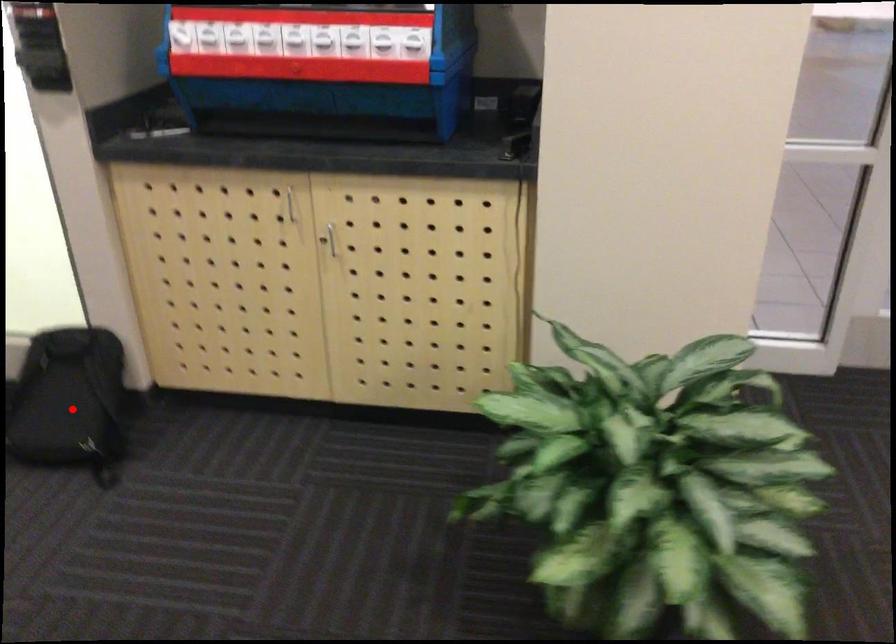
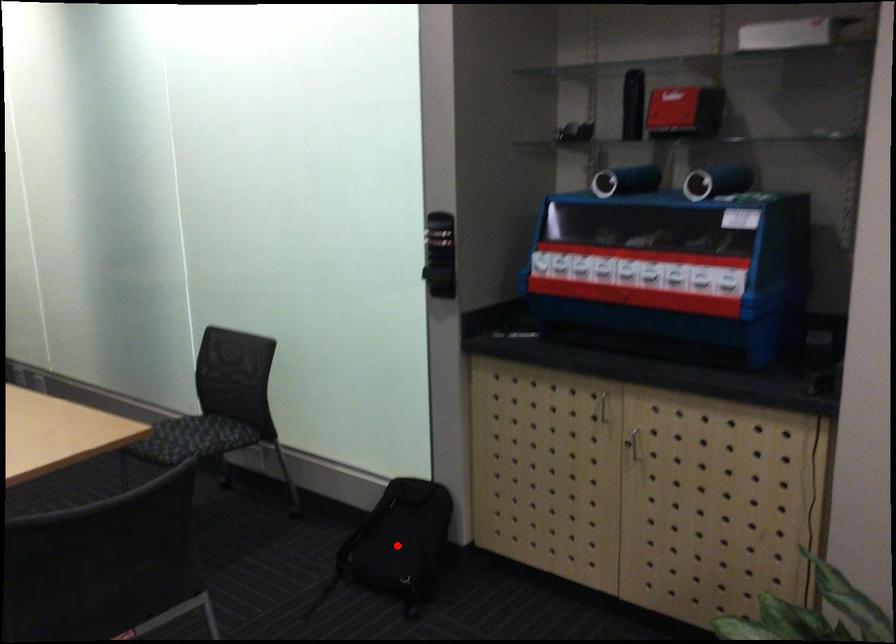
I am providing you with two images of the same scene from different viewpoints. A red point is marked on the first image and another point is marked on the second image. Do the highlighted points in image1 and image2 indicate the same real-world spot?

Yes